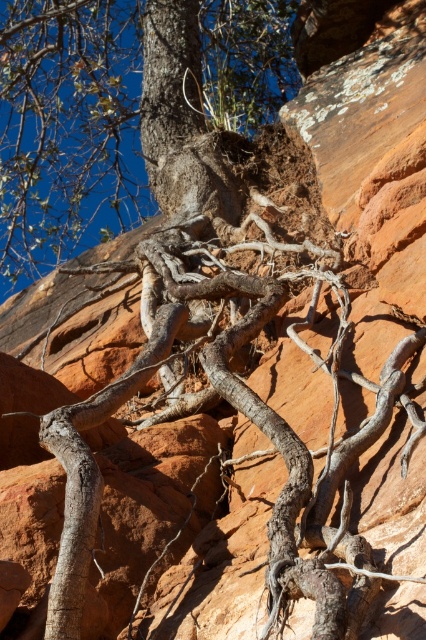
Is point (45, 156) more distant than point (94, 516)?

Yes, it is.

From the picture: Does gray rough bark tree at center have a greater height compared to smooth gray bark at center?

Correct, gray rough bark tree at center is much taller as smooth gray bark at center.

At what (x,y) coordinates should I click in order to perform the action: click on gray rough bark tree at center. Please return your answer as a coordinate pair (x, y). Image resolution: width=426 pixels, height=640 pixels. Looking at the image, I should click on (66, 125).

Identify the location of gray rough bark tree at center. The image size is (426, 640). (66, 125).

Does smooth bark tree trunk at upper center appear over smooth gray bark at center?

Indeed, smooth bark tree trunk at upper center is positioned over smooth gray bark at center.

Is smooth bark tree trunk at upper center smaller than smooth gray bark at center?

No, smooth bark tree trunk at upper center is not smaller than smooth gray bark at center.

Where is `smooth bark tree trunk at upper center`? The height and width of the screenshot is (640, 426). smooth bark tree trunk at upper center is located at coordinates (180, 116).

From the picture: Can you confirm if gray rough bark tree at center is positioned above smooth bark tree trunk at upper center?

Correct, gray rough bark tree at center is located above smooth bark tree trunk at upper center.

Who is more forward, [58,33] or [178,40]?

Positioned in front is point [178,40].

At what (x,y) coordinates should I click in order to perform the action: click on gray rough bark tree at center. Please return your answer as a coordinate pair (x, y). The height and width of the screenshot is (640, 426). Looking at the image, I should click on click(x=66, y=125).